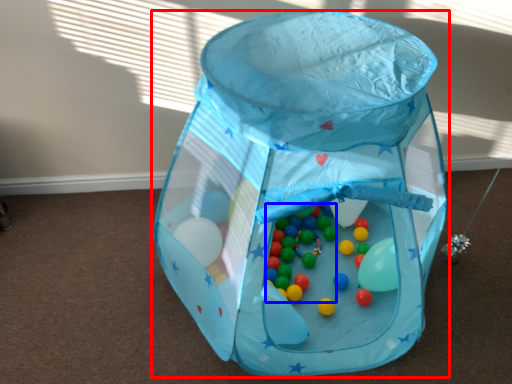
Question: Which point is closer to the camera, baby carriage (highlighted by a red box) or toy (highlighted by a blue box)?

Choices:
 (A) baby carriage
 (B) toy

Answer: (A)